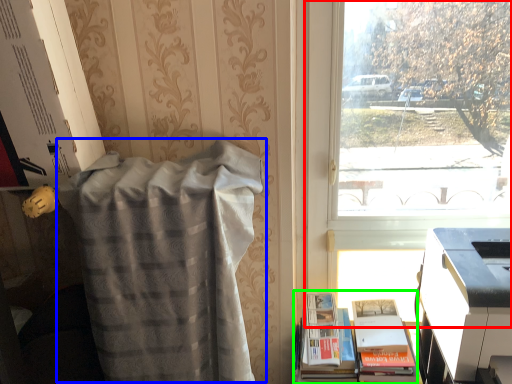
Question: Based on their relative distances, which object is nearer to window (highlighted by a red box)? Choose from blanket (highlighted by a blue box) and book (highlighted by a green box).

Choices:
 (A) blanket
 (B) book

Answer: (A)